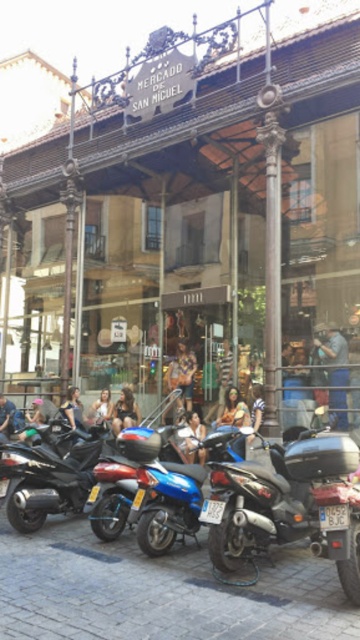
Is light brown leather jacket at center wider than striped fabric shirt at center?

Yes.

Which is more to the right, light brown leather jacket at center or striped fabric shirt at center?

Positioned to the right is striped fabric shirt at center.

Identify the location of light brown leather jacket at center. The image size is (360, 640). (101, 406).

Is denim jacket at center to the right of blue leather jacket at center from the viewer's perspective?

Incorrect, denim jacket at center is not on the right side of blue leather jacket at center.

Is point (118, 429) positioned in front of point (191, 419)?

No, (118, 429) is behind (191, 419).

Which is in front, point (128, 392) or point (192, 445)?

Positioned in front is point (192, 445).

The height and width of the screenshot is (640, 360). I want to click on denim jacket at center, so click(x=124, y=412).

Does matte brown leather jacket at center come behind striped fabric shirt at center?

That is True.

Is matte brown leather jacket at center shorter than striped fabric shirt at center?

Yes, matte brown leather jacket at center is shorter than striped fabric shirt at center.

Which is behind, point (236, 417) or point (254, 396)?

Point (236, 417)

You are a GUI agent. You are given a task and a screenshot of the screen. Output one action in this format:
    pyautogui.click(x=<x>, y=<y>)
    Task: Click on the matte brown leather jacket at center
    This screenshot has width=360, height=640.
    Given the screenshot: What is the action you would take?
    pyautogui.click(x=234, y=410)